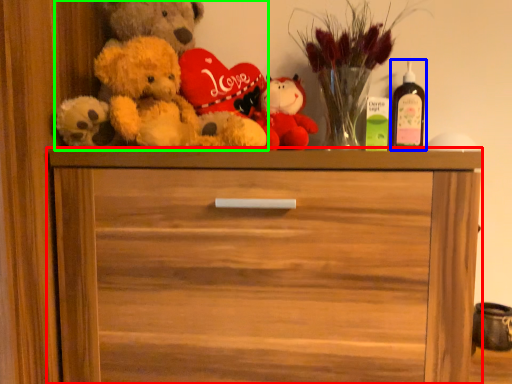
Question: Considering the real-world distances, which object is closest to chest of drawers (highlighted by a red box)? wine bottle (highlighted by a blue box) or teddy bear (highlighted by a green box).

Choices:
 (A) wine bottle
 (B) teddy bear

Answer: (B)